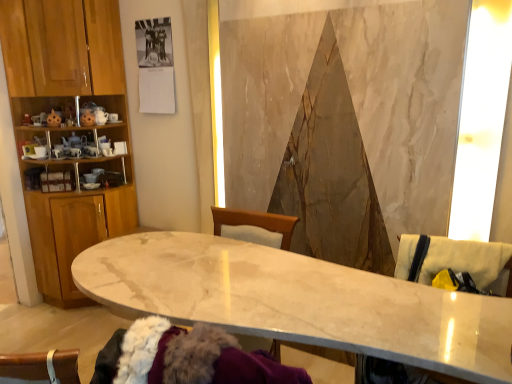
You are a GUI agent. You are given a task and a screenshot of the screen. Output one action in this format:
    pyautogui.click(x=<x>, y=<y>)
    Task: Click on the empty space that is ontop of beige fabric swivel chair at right, which ranks as the first swivel chair in top-to-bottom order (from a real-world perspective)
    
    Given the screenshot: What is the action you would take?
    pyautogui.click(x=451, y=241)